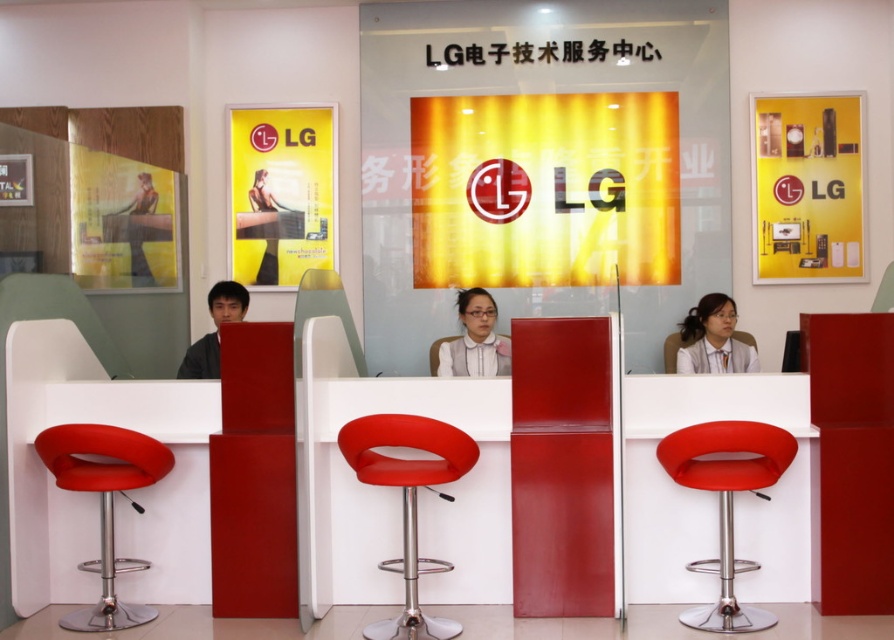
Question: Which of these objects is positioned farthest from the red leather bar stool at center?

Choices:
 (A) matte black shirt at left
 (B) smooth red stool at center

Answer: (A)

Question: Does matte red bar stool at lower right appear on the left side of matte red stool at center?

Choices:
 (A) yes
 (B) no

Answer: (A)

Question: Does matte white blouse at center have a lesser width compared to matte red stool at center?

Choices:
 (A) yes
 (B) no

Answer: (B)

Question: Is white glossy blouse at center thinner than matte red stool at center?

Choices:
 (A) yes
 (B) no

Answer: (B)

Question: Estimate the real-world distances between objects in this image. Which object is closer to the matte red stool at center?

Choices:
 (A) white glossy blouse at center
 (B) matte white blouse at center

Answer: (B)

Question: Which of the following is the closest to the observer?

Choices:
 (A) matte black shirt at left
 (B) matte red stool at center
 (C) matte red bar stool at lower right

Answer: (C)